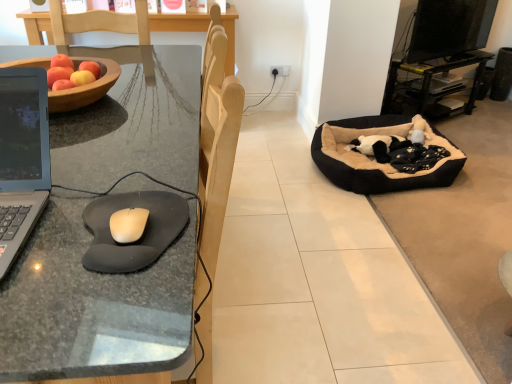
The image size is (512, 384). Find the location of `free space to the left of black plush dog bed at right`. free space to the left of black plush dog bed at right is located at coordinates (277, 170).